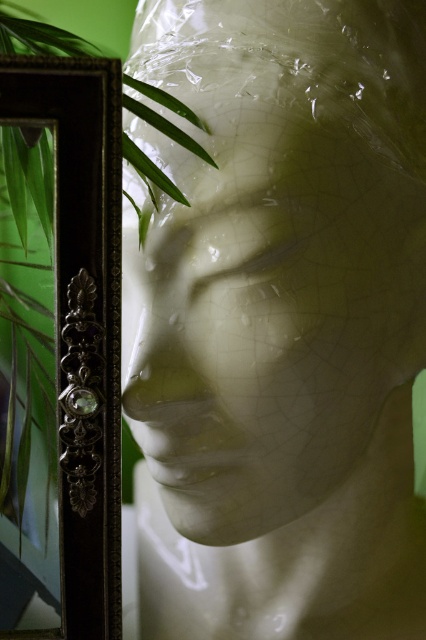
Question: Can you confirm if dark brown wood picture frame at left is positioned above green leafy plant at left?

Choices:
 (A) yes
 (B) no

Answer: (B)

Question: Does white matte sculpture at center come behind green leafy plant at left?

Choices:
 (A) no
 (B) yes

Answer: (B)

Question: Which object appears farthest from the camera in this image?

Choices:
 (A) green leafy plant at left
 (B) dark brown wood picture frame at left
 (C) white matte sculpture at center

Answer: (C)

Question: Estimate the real-world distances between objects in this image. Which object is closer to the dark brown wood picture frame at left?

Choices:
 (A) green leafy plant at left
 (B) white matte sculpture at center

Answer: (A)

Question: Among these objects, which one is nearest to the camera?

Choices:
 (A) green leafy plant at left
 (B) dark brown wood picture frame at left

Answer: (B)

Question: Is white matte sculpture at center below green leafy plant at left?

Choices:
 (A) yes
 (B) no

Answer: (A)